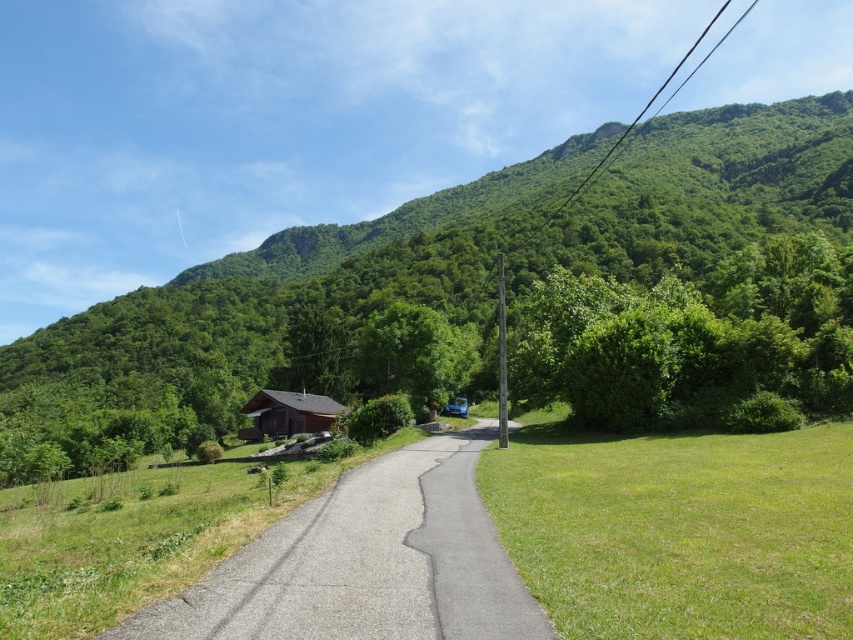
Does green leafy tree at center have a greater width compared to gray asphalt driveway at center?

Yes.

You are a GUI agent. You are given a task and a screenshot of the screen. Output one action in this format:
    pyautogui.click(x=<x>, y=<y>)
    Task: Click on the green leafy tree at center
    The image size is (853, 640).
    Given the screenshot: What is the action you would take?
    pyautogui.click(x=438, y=264)

Is gray asphalt driveway at center taller than brown wooden cabin at center?

In fact, gray asphalt driveway at center may be shorter than brown wooden cabin at center.

Is gray asphalt driveway at center to the right of brown wooden cabin at center from the viewer's perspective?

Correct, you'll find gray asphalt driveway at center to the right of brown wooden cabin at center.

Which is in front, point (469, 632) or point (339, 410)?

Point (469, 632) is more forward.

This screenshot has height=640, width=853. Identify the location of gray asphalt driveway at center. (366, 563).

Looking at this image, between green leafy tree at center and brown wooden cabin at center, which one is positioned higher?

Positioned higher is green leafy tree at center.

Is point (793, 170) positioned before point (267, 433)?

No, (793, 170) is further to viewer.

The image size is (853, 640). Identify the location of green leafy tree at center. (438, 264).